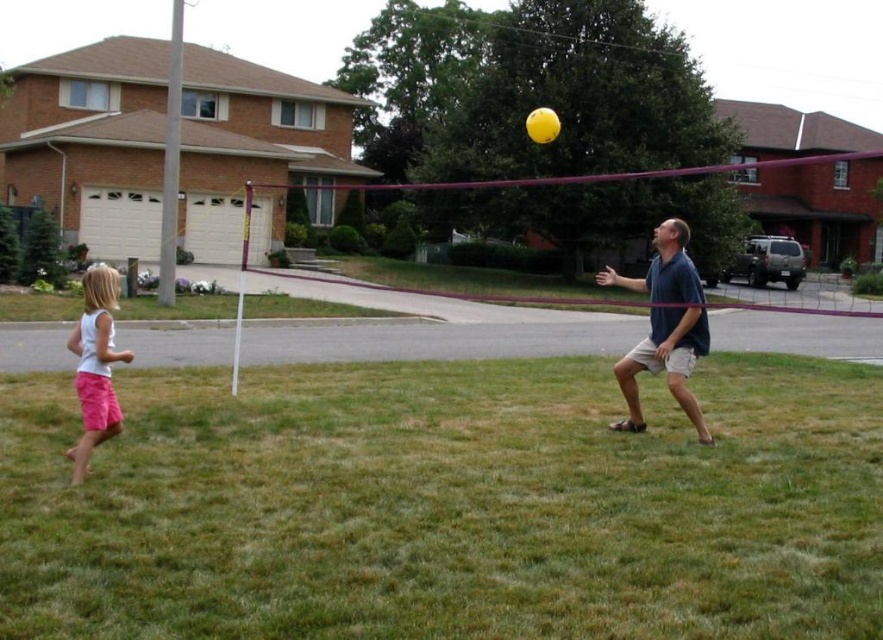
You are standing at the edge of the lawn where the volleyball net is placed. You need to throw a ball to the blue cotton shirt at right without it touching the green grass at center. Is this possible given their distance?

The green grass at center is 3.24 meters away from the blue cotton shirt at right. Since the distance is 3.24 meters, you can throw the ball directly to the blue cotton shirt at right without it landing on the green grass at center if you aim accurately.

You are standing in the outdoor scene and want to place a small bench between the green grass at center and the blue cotton shirt at right. Can you tell me which object the bench will be closer to?

The green grass at center is closer to the viewer than the blue cotton shirt at right, so the bench placed between them will be closer to the blue cotton shirt at right.